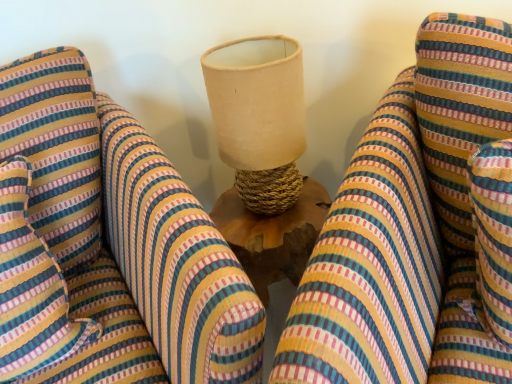
Question: Looking at the image, does striped fabric pillow at left seem bigger or smaller compared to striped fabric bean bag chair at center, which ranks as the 2th bean bag chair in left-to-right order?

Choices:
 (A) big
 (B) small

Answer: (B)

Question: Based on their positions, is striped fabric pillow at left located to the left or right of striped fabric bean bag chair at center, which ranks as the 2th bean bag chair in left-to-right order?

Choices:
 (A) left
 (B) right

Answer: (A)

Question: Which is nearer to the beige fabric lampshade at center?

Choices:
 (A) striped fabric pillow at left
 (B) striped fabric bean bag chair at center, which ranks as the 2th bean bag chair in left-to-right order
 (C) striped fabric bean bag chair at center, marked as the 1th bean bag chair in a left-to-right arrangement

Answer: (C)

Question: Considering the real-world distances, which object is closest to the striped fabric pillow at left?

Choices:
 (A) striped fabric bean bag chair at center, the 2th bean bag chair viewed from the right
 (B) striped fabric bean bag chair at center, which ranks as the 2th bean bag chair in left-to-right order
 (C) beige fabric lampshade at center

Answer: (A)